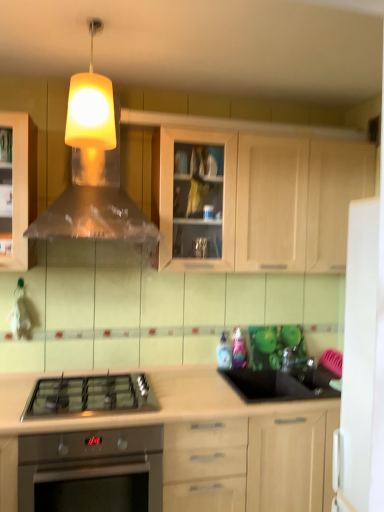
Locate an element on the screen. vacant region to the left of satin nickel faucet at right is located at coordinates (273, 374).